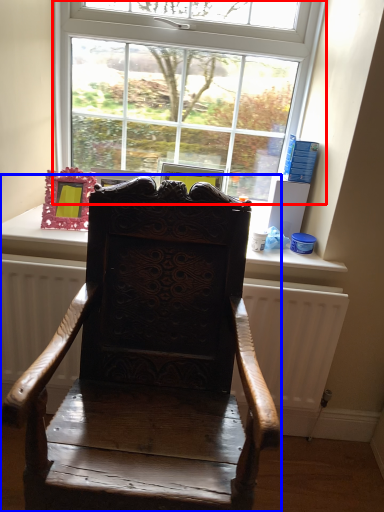
Question: Which of the following is the farthest to the observer, window (highlighted by a red box) or chair (highlighted by a blue box)?

Choices:
 (A) window
 (B) chair

Answer: (A)